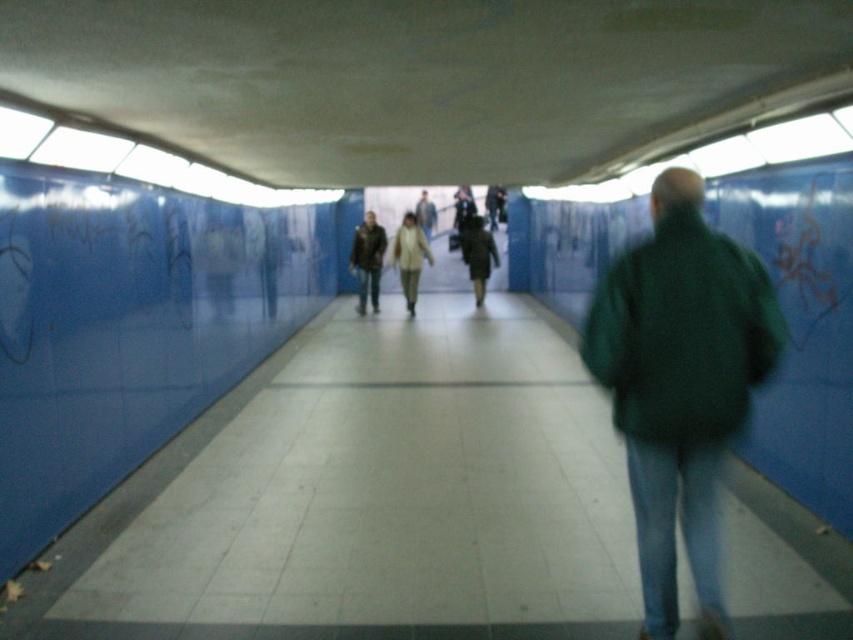
Question: Which point is closer to the camera?

Choices:
 (A) (392, 243)
 (B) (479, 248)
 (C) (666, 557)
 (D) (370, 253)

Answer: (C)

Question: From the image, what is the correct spatial relationship of matte brown jacket at center in relation to light beige fabric coat at center?

Choices:
 (A) left
 (B) right

Answer: (A)

Question: Can you confirm if green matte jacket at right is positioned above dark gray coat at center?

Choices:
 (A) no
 (B) yes

Answer: (A)

Question: Which of the following is the closest to the observer?

Choices:
 (A) light beige fabric coat at center
 (B) matte brown jacket at center

Answer: (A)

Question: Which of these objects is positioned closest to the dark gray coat at center?

Choices:
 (A) light beige fabric coat at center
 (B) green matte jacket at right

Answer: (A)

Question: Considering the relative positions of matte brown jacket at center and light beige fabric coat at center in the image provided, where is matte brown jacket at center located with respect to light beige fabric coat at center?

Choices:
 (A) above
 (B) below

Answer: (A)